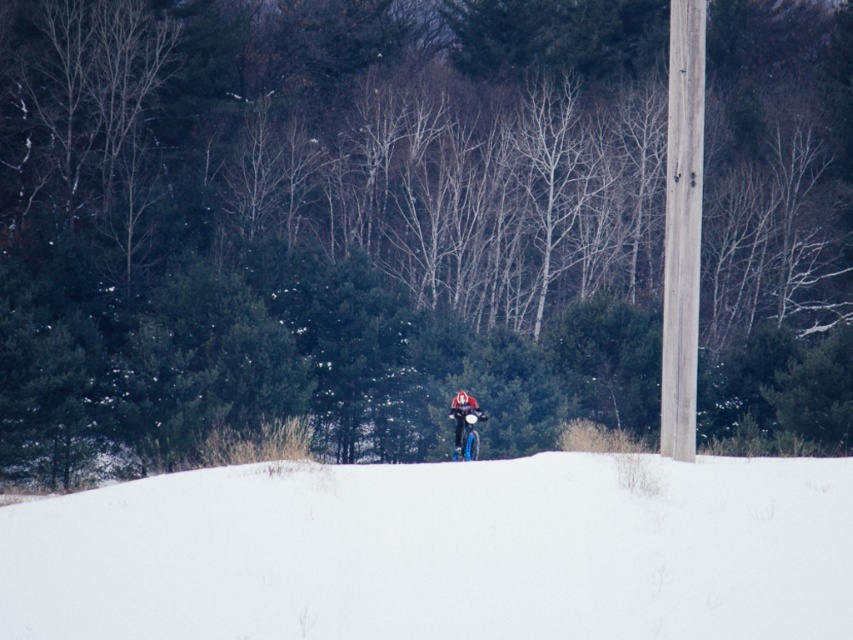
You are a photographer standing in the winter scene. You want to take a photo that includes both the white snow at center and the concrete pole at right. Which object should you focus on first to ensure both are in clear view?

The white snow at center is closer to the viewer than the concrete pole at right, so you should focus on the white snow at center first to ensure both are in clear view.

From the picture: You are standing in the snowy landscape and want to place a small flag at the point closer to you between point (682, 413) and point (462, 420). According to the image, where should you place the flag?

You should place the flag at point (682, 413) because it is closer to the viewer than point (462, 420).